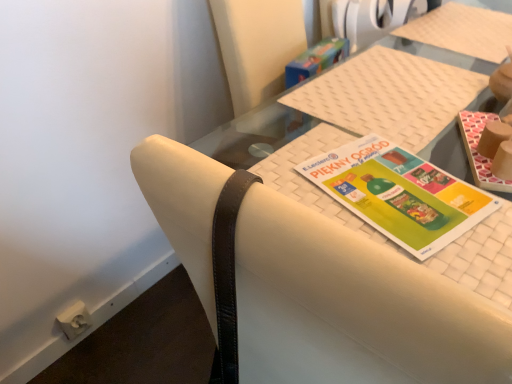
Question: Does white leather chair at center have a smaller size compared to matte brown book at upper right, placed as the second book when sorted from left to right?

Choices:
 (A) no
 (B) yes

Answer: (A)

Question: Is matte brown book at upper right, placed as the second book when sorted from left to right, at the back of white leather chair at center?

Choices:
 (A) no
 (B) yes

Answer: (A)

Question: Does white leather chair at center turn towards matte brown book at upper right, positioned as the first book in right-to-left order?

Choices:
 (A) yes
 (B) no

Answer: (A)

Question: Is white leather chair at center further to the viewer compared to matte brown book at upper right, positioned as the first book in right-to-left order?

Choices:
 (A) no
 (B) yes

Answer: (A)

Question: Considering the relative sizes of white leather chair at center and matte brown book at upper right, placed as the second book when sorted from left to right, in the image provided, is white leather chair at center wider than matte brown book at upper right, placed as the second book when sorted from left to right,?

Choices:
 (A) no
 (B) yes

Answer: (B)

Question: From a real-world perspective, is white leather chair at center physically located above or below multicolored paper at center, positioned as the 2th book in right-to-left order?

Choices:
 (A) above
 (B) below

Answer: (A)

Question: Is point (407, 364) closer or farther from the camera than point (451, 185)?

Choices:
 (A) farther
 (B) closer

Answer: (B)

Question: Is white leather chair at center to the left or to the right of multicolored paper at center, positioned as the 1th book in left-to-right order, in the image?

Choices:
 (A) left
 (B) right

Answer: (A)

Question: Is white leather chair at center in front of or behind multicolored paper at center, positioned as the 1th book in left-to-right order, in the image?

Choices:
 (A) front
 (B) behind

Answer: (A)

Question: Considering the positions of white woven placemat at center and matte brown book at upper right, placed as the second book when sorted from left to right, in the image, is white woven placemat at center taller or shorter than matte brown book at upper right, placed as the second book when sorted from left to right,?

Choices:
 (A) short
 (B) tall

Answer: (B)

Question: From the image's perspective, is white woven placemat at center positioned above or below matte brown book at upper right, positioned as the first book in right-to-left order?

Choices:
 (A) below
 (B) above

Answer: (A)

Question: Is white woven placemat at center wider or thinner than matte brown book at upper right, placed as the second book when sorted from left to right?

Choices:
 (A) thin
 (B) wide

Answer: (B)

Question: Is white woven placemat at center spatially inside matte brown book at upper right, positioned as the first book in right-to-left order, or outside of it?

Choices:
 (A) outside
 (B) inside

Answer: (A)

Question: Based on their sizes in the image, would you say multicolored paper at center, positioned as the 1th book in left-to-right order, is bigger or smaller than matte brown book at upper right, placed as the second book when sorted from left to right?

Choices:
 (A) small
 (B) big

Answer: (A)

Question: Is multicolored paper at center, positioned as the 2th book in right-to-left order, spatially inside matte brown book at upper right, placed as the second book when sorted from left to right, or outside of it?

Choices:
 (A) inside
 (B) outside

Answer: (B)